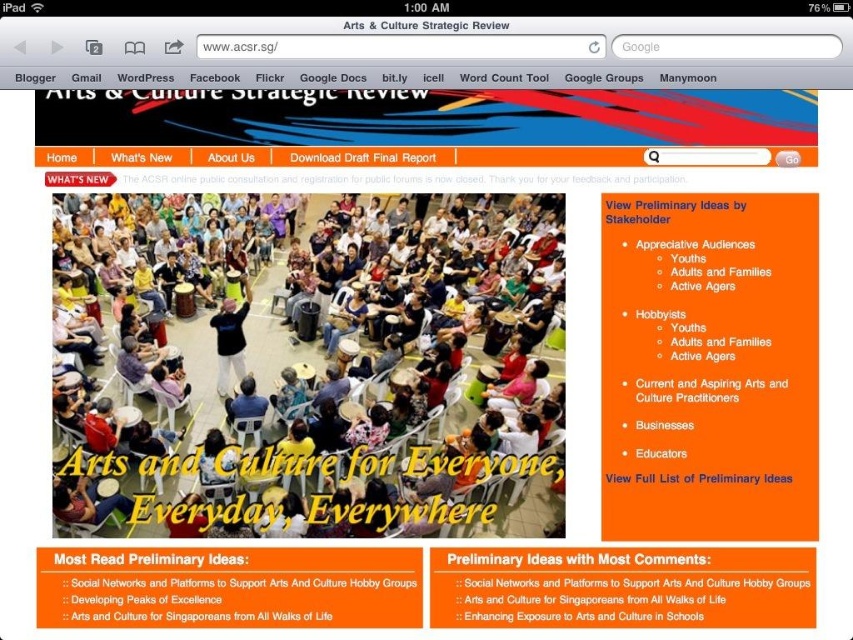
You are viewing the ACSR webpage on an iPad. There are two points marked on the screen at coordinates point (94, 493) and point (231, 352). Which point is closer to your eyes?

Point (94, 493) is closer to the viewer than point (231, 352).

You are looking at a webpage on an iPad. You see a black matte shirt at center and matte plastic chairs at lower center. Which object is positioned to the right of the other?

The matte plastic chairs at lower center are positioned to the right of the black matte shirt at center.

You are a visitor to the ACSR website on an iPad. You see the matte plastic chairs at lower center and the black matte shirt at center. Which object appears taller on the screen?

The black matte shirt at center appears taller than the matte plastic chairs at lower center because the matte plastic chairs at lower center is not as tall as black matte shirt at center.